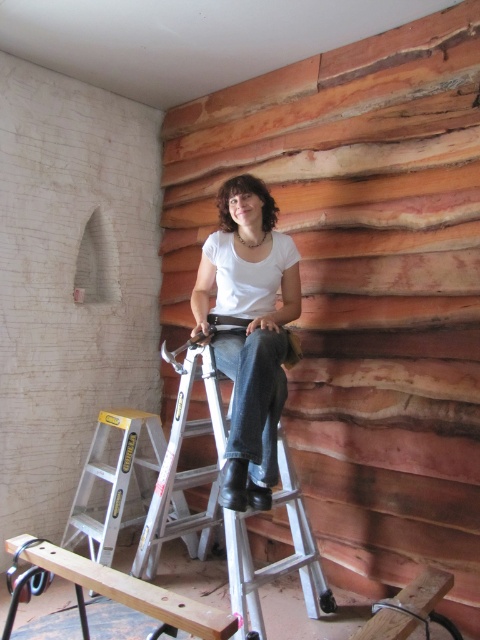
Does silver metallic ladder at center have a smaller size compared to wooden plank at lower center?

Actually, silver metallic ladder at center might be larger than wooden plank at lower center.

Between silver metallic ladder at center and wooden plank at lower center, which one appears on the left side from the viewer's perspective?

Positioned to the left is wooden plank at lower center.

Find the location of a particular element. silver metallic ladder at center is located at coordinates (226, 508).

Which is more to the right, matte white shirt at center or wooden plank at lower center?

matte white shirt at center is more to the right.

What are the coordinates of `matte white shirt at center` in the screenshot? It's located at [250, 330].

Locate an element on the screen. matte white shirt at center is located at coordinates (250, 330).

Does point (223, 236) lie behind point (211, 410)?

Yes.

Identify the location of matte white shirt at center. This screenshot has height=640, width=480. (250, 330).